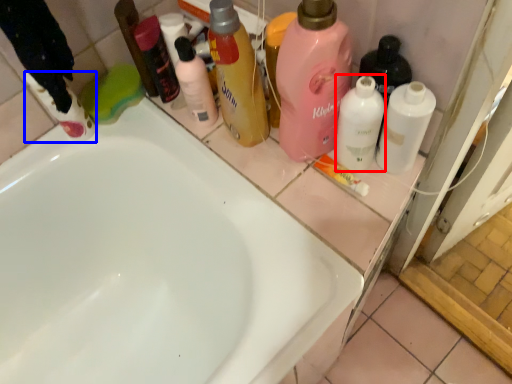
Question: Among these objects, which one is farthest to the camera, cleaning product (highlighted by a red box) or cleaning product (highlighted by a blue box)?

Choices:
 (A) cleaning product
 (B) cleaning product

Answer: (B)